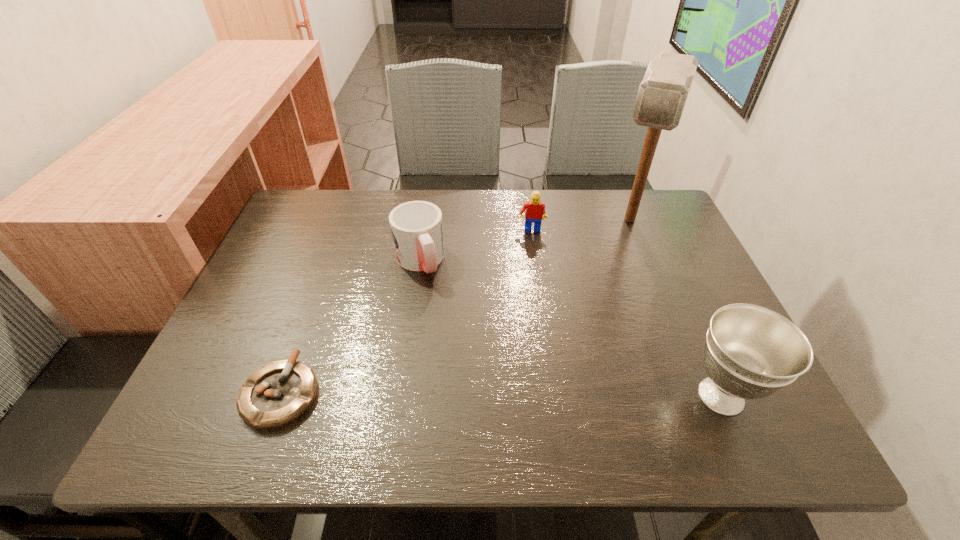
The image size is (960, 540). Find the location of `ashtray located at the near edge`. ashtray located at the near edge is located at coordinates (276, 394).

Where is `chalice located at the near edge`? chalice located at the near edge is located at coordinates (751, 352).

Find the location of a particular element. This screenshot has height=540, width=960. object at the left edge is located at coordinates (276, 394).

Where is `chalice that is positioned at the right edge`? This screenshot has height=540, width=960. chalice that is positioned at the right edge is located at coordinates (751, 352).

What are the coordinates of `mallet that is at the right edge` in the screenshot? It's located at (662, 94).

This screenshot has height=540, width=960. What are the coordinates of `object that is at the near left corner` in the screenshot? It's located at (276, 394).

Where is `object that is at the far right corner`? The width and height of the screenshot is (960, 540). object that is at the far right corner is located at coordinates (662, 94).

Where is `object located in the near right corner section of the desktop`? object located in the near right corner section of the desktop is located at coordinates (751, 352).

At what (x,y) coordinates should I click in order to perform the action: click on vacant region at the far edge. Please return your answer as a coordinate pair (x, y). Looking at the image, I should click on coord(471,197).

The width and height of the screenshot is (960, 540). I want to click on free space at the near edge of the desktop, so click(x=460, y=388).